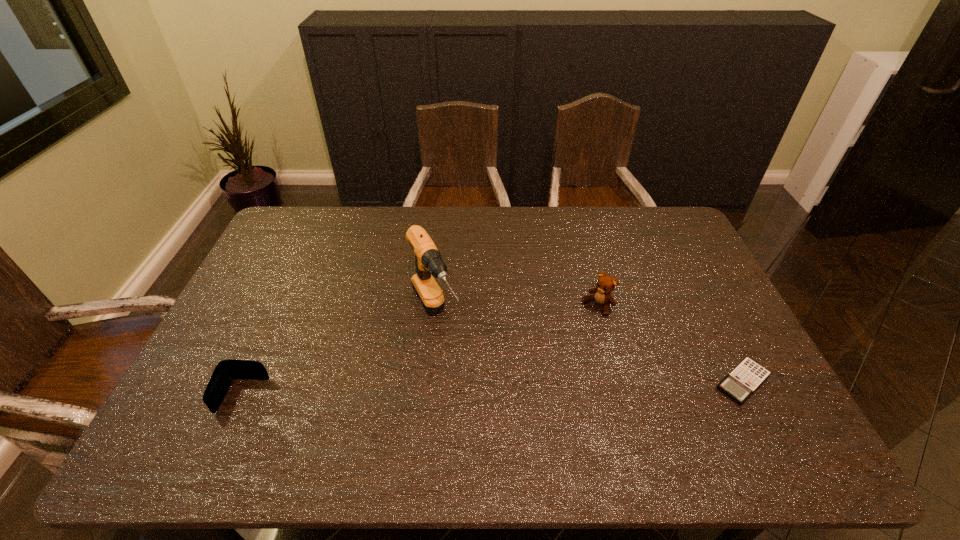
Where is `the third tallest object`? This screenshot has height=540, width=960. the third tallest object is located at coordinates (226, 370).

Image resolution: width=960 pixels, height=540 pixels. What are the coordinates of `wallet` in the screenshot? It's located at (226, 370).

I want to click on the rightmost object, so click(x=747, y=376).

This screenshot has width=960, height=540. I want to click on the shortest object, so click(747, 376).

Where is `the tallest object`? This screenshot has width=960, height=540. the tallest object is located at coordinates (428, 261).

Identify the location of drill. (428, 261).

Find the location of `the third object from left to right`. the third object from left to right is located at coordinates (602, 295).

This screenshot has height=540, width=960. I want to click on teddy bear, so click(x=602, y=295).

Identify the location of free space located on the back of the shortest object. This screenshot has height=540, width=960. (693, 285).

Locate an element on the screen. blank space located 0.060m at the tip of the third object from right to left is located at coordinates (454, 365).